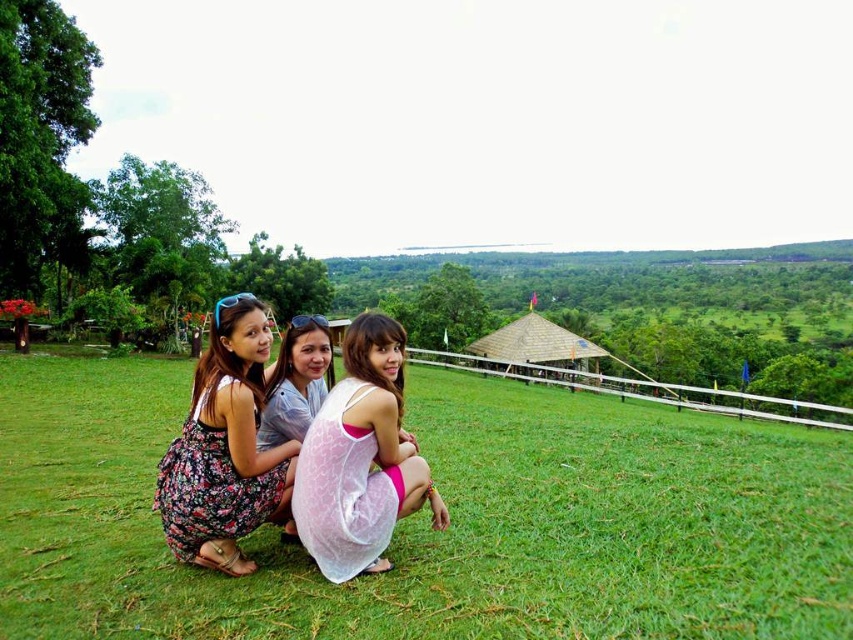
Question: Is floral fabric dress at lower left to the left of floral dress at center from the viewer's perspective?

Choices:
 (A) no
 (B) yes

Answer: (B)

Question: Can you confirm if white lace dress at center is positioned below floral fabric dress at lower left?

Choices:
 (A) yes
 (B) no

Answer: (B)

Question: Which point appears farthest from the camera in this image?

Choices:
 (A) (659, 509)
 (B) (283, 404)
 (C) (318, 536)

Answer: (A)

Question: Which object appears closest to the camera in this image?

Choices:
 (A) floral dress at center
 (B) green grass at center
 (C) white lace dress at center
 (D) floral fabric dress at lower left

Answer: (B)

Question: Can you confirm if white lace dress at center is smaller than floral fabric dress at lower left?

Choices:
 (A) no
 (B) yes

Answer: (A)

Question: Which object is the farthest from the white lace dress at center?

Choices:
 (A) floral dress at center
 (B) green grass at center

Answer: (B)